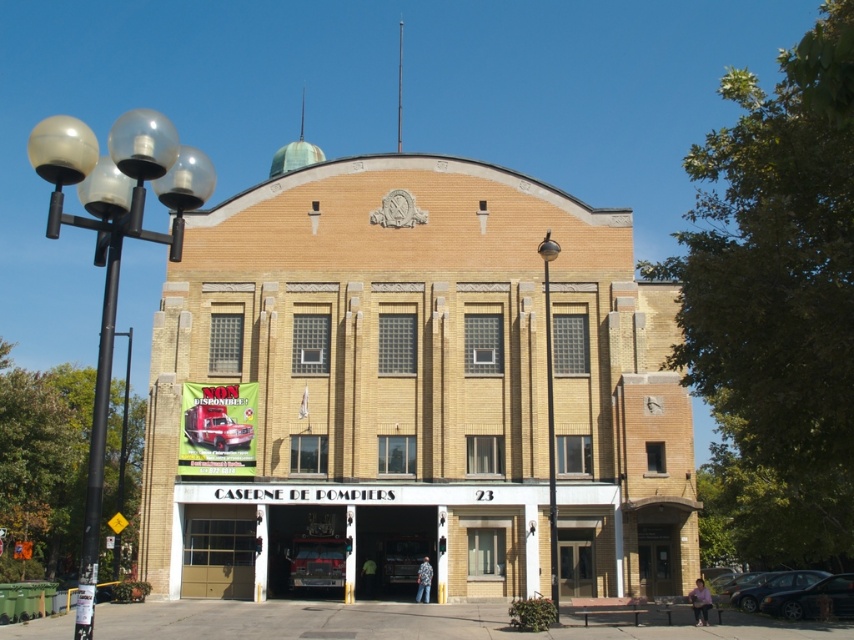
Who is more forward, (817, 577) or (741, 586)?

Point (817, 577) is in front.

Is point (759, 596) closer to viewer compared to point (764, 572)?

Yes.

Identify the location of dark green matte car at lower right. (774, 586).

Which is more to the right, shiny black sedan at lower right or dark green matte car at lower right?

shiny black sedan at lower right is more to the right.

Does shiny black sedan at lower right have a smaller size compared to dark green matte car at lower right?

Yes, shiny black sedan at lower right is smaller than dark green matte car at lower right.

You are a GUI agent. You are given a task and a screenshot of the screen. Output one action in this format:
    pyautogui.click(x=<x>, y=<y>)
    Task: Click on the shiny black sedan at lower right
    This screenshot has height=640, width=854.
    Given the screenshot: What is the action you would take?
    pyautogui.click(x=812, y=600)

The width and height of the screenshot is (854, 640). I want to click on shiny black sedan at lower right, so click(x=812, y=600).

You are a GUI agent. You are given a task and a screenshot of the screen. Output one action in this format:
    pyautogui.click(x=<x>, y=<y>)
    Task: Click on the yellow brick building at center
    This screenshot has height=640, width=854.
    Given the screenshot: What is the action you would take?
    pyautogui.click(x=417, y=392)

Is yellow brick building at center wider than shiny black car at lower right?

Yes, yellow brick building at center is wider than shiny black car at lower right.

What do you see at coordinates (417, 392) in the screenshot? I see `yellow brick building at center` at bounding box center [417, 392].

The height and width of the screenshot is (640, 854). Identify the location of yellow brick building at center. click(417, 392).